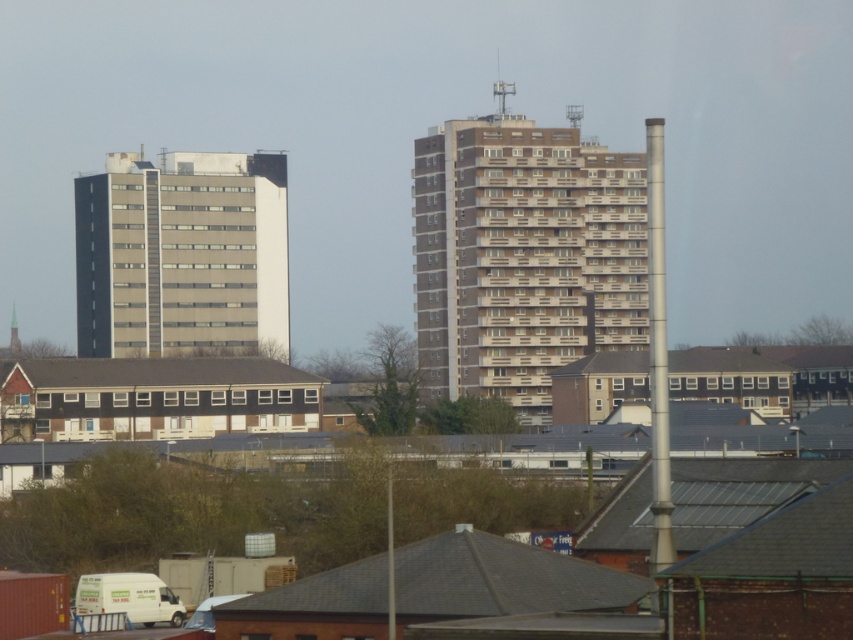
Is point (440, 124) positioned in front of point (200, 160)?

That is False.

Does brown concrete building at center appear over beige concrete building at left?

Incorrect, brown concrete building at center is not positioned above beige concrete building at left.

Describe the element at coordinates (523, 253) in the screenshot. I see `brown concrete building at center` at that location.

The image size is (853, 640). I want to click on brown concrete building at center, so click(523, 253).